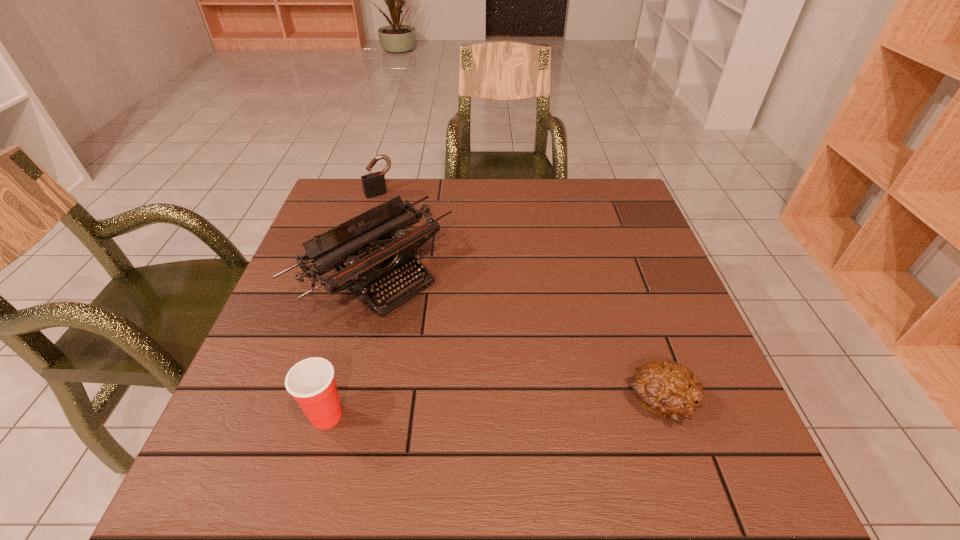
I want to click on vacant space positioned on the typing side of the tallest object, so click(x=514, y=387).

You are a GUI agent. You are given a task and a screenshot of the screen. Output one action in this format:
    pyautogui.click(x=<x>, y=<y>)
    Task: Click on the vacant space located 0.070m with the keyhole on the front of the farthest object
    The width and height of the screenshot is (960, 540).
    Given the screenshot: What is the action you would take?
    pyautogui.click(x=394, y=210)

You are a GUI agent. You are given a task and a screenshot of the screen. Output one action in this format:
    pyautogui.click(x=<x>, y=<y>)
    Task: Click on the vacant area located with the keyhole on the front of the farthest object
    
    Given the screenshot: What is the action you would take?
    pyautogui.click(x=422, y=251)

The image size is (960, 540). I want to click on vacant space positioned 0.170m with the keyhole on the front of the farthest object, so click(406, 228).

Identify the location of object that is at the far edge. (374, 184).

Locate an element on the screen. The width and height of the screenshot is (960, 540). Dixie cup situated at the near edge is located at coordinates (311, 382).

At what (x,y) coordinates should I click in order to perform the action: click on muffin situated at the near edge. Please return your answer as a coordinate pair (x, y). This screenshot has height=540, width=960. Looking at the image, I should click on (665, 388).

The height and width of the screenshot is (540, 960). I want to click on Dixie cup positioned at the left edge, so click(x=311, y=382).

The width and height of the screenshot is (960, 540). In order to click on typewriter at the left edge in this screenshot , I will do `click(377, 267)`.

Where is `padlock that is at the left edge`? This screenshot has width=960, height=540. padlock that is at the left edge is located at coordinates (374, 184).